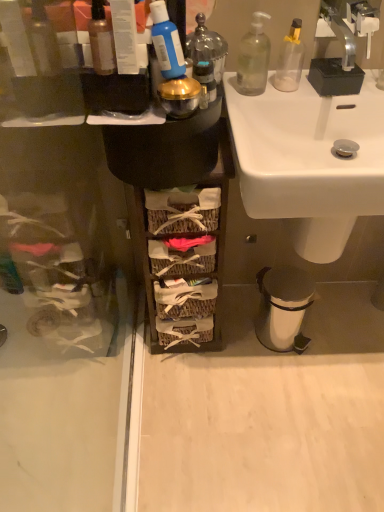
What do you see at coordinates (101, 40) in the screenshot?
I see `translucent glass bottle at upper left, placed as the first bottle when sorted from left to right` at bounding box center [101, 40].

Measure the distance between shiny metallic container at upper center, the 2th toiletry positioned from the front, and camera.

shiny metallic container at upper center, the 2th toiletry positioned from the front, and camera are 32.54 inches apart from each other.

Where is `silver metallic faucet at upper right`? silver metallic faucet at upper right is located at coordinates (350, 23).

Can you see transparent plastic bottle at upper right, the 1th bottle positioned from the right, touching clear glass bottle at upper right, the 2th bottle viewed from the back?

Yes.

Considering the relative sizes of transparent plastic bottle at upper right, the 1th bottle positioned from the right, and clear glass bottle at upper right, which is the 2th bottle from front to back, in the image provided, is transparent plastic bottle at upper right, the 1th bottle positioned from the right, bigger than clear glass bottle at upper right, which is the 2th bottle from front to back,?

Incorrect, transparent plastic bottle at upper right, the 1th bottle positioned from the right, is not larger than clear glass bottle at upper right, which is the 2th bottle from front to back.

From the image's perspective, is transparent plastic bottle at upper right, which is counted as the first bottle, starting from the back, located above clear glass bottle at upper right, acting as the 2th bottle starting from the left?

Correct, transparent plastic bottle at upper right, which is counted as the first bottle, starting from the back, appears higher than clear glass bottle at upper right, acting as the 2th bottle starting from the left, in the image.

Based on the photo, is transparent plastic bottle at upper right, the 1th bottle positioned from the right, oriented away from clear glass bottle at upper right, the 2th bottle viewed from the back?

No, clear glass bottle at upper right, the 2th bottle viewed from the back, is not at the back of transparent plastic bottle at upper right, the 1th bottle positioned from the right.

From the image's perspective, is translucent glass bottle at upper left, which ranks as the first bottle in front-to-back order, positioned above or below woven wood baskets at center?

Based on their image positions, translucent glass bottle at upper left, which ranks as the first bottle in front-to-back order, is located above woven wood baskets at center.

Which object is more forward, translucent glass bottle at upper left, marked as the 3th bottle in a back-to-front arrangement, or woven wood baskets at center?

Positioned in front is translucent glass bottle at upper left, marked as the 3th bottle in a back-to-front arrangement.

Visually, is translucent glass bottle at upper left, which ranks as the first bottle in front-to-back order, positioned to the left or to the right of woven wood baskets at center?

translucent glass bottle at upper left, which ranks as the first bottle in front-to-back order, is to the left of woven wood baskets at center.

Where is `cabinetry located on the right of translucent glass bottle at upper left, marked as the 3th bottle in a back-to-front arrangement`? Image resolution: width=384 pixels, height=512 pixels. cabinetry located on the right of translucent glass bottle at upper left, marked as the 3th bottle in a back-to-front arrangement is located at coordinates (190, 237).

Is white ceramic sink at center at the back of woven wood baskets at center?

No.

Who is more distant, woven wood baskets at center or white ceramic sink at center?

woven wood baskets at center is behind.

Is woven wood baskets at center touching white ceramic sink at center?

There is a gap between woven wood baskets at center and white ceramic sink at center.

How many degrees apart are the facing directions of woven wood baskets at center and white ceramic sink at center?

0.128 degrees separate the facing orientations of woven wood baskets at center and white ceramic sink at center.

Can you confirm if shiny metallic container at upper center, the 2th toiletry positioned from the front, is taller than clear glass bottle at upper right, which is the 2th bottle from front to back?

No.

Can we say shiny metallic container at upper center, arranged as the first toiletry when viewed from the back, lies outside clear glass bottle at upper right, the 2th bottle viewed from the back?

That's correct, shiny metallic container at upper center, arranged as the first toiletry when viewed from the back, is outside of clear glass bottle at upper right, the 2th bottle viewed from the back.

From the picture: Could you tell me if shiny metallic container at upper center, the 2th toiletry positioned from the front, is turned towards clear glass bottle at upper right, which is the 2th bottle from front to back?

No.

Locate an element on the screen. The width and height of the screenshot is (384, 512). toiletry that is the 1st object located below the clear glass bottle at upper right, which is the 2th bottle from front to back (from the image's perspective) is located at coordinates (207, 47).

In the scene shown: Between shiny metallic container at upper center, the 2th toiletry positioned from the front, and white ceramic sink at center, which one is positioned in front?

white ceramic sink at center is more forward.

From the image's perspective, is shiny metallic container at upper center, arranged as the first toiletry when viewed from the back, above or below white ceramic sink at center?

shiny metallic container at upper center, arranged as the first toiletry when viewed from the back, is above white ceramic sink at center.

Considering the positions of points (204, 37) and (255, 114), is point (204, 37) closer to camera compared to point (255, 114)?

Yes, point (204, 37) is in front of point (255, 114).

From a real-world perspective, who is located higher, shiny metallic container at upper center, arranged as the first toiletry when viewed from the back, or white ceramic sink at center?

shiny metallic container at upper center, arranged as the first toiletry when viewed from the back.

From a real-world perspective, between blue matte toothpaste tube at upper center, the 2th toiletry from the back, and transparent plastic bottle at upper right, the 3th bottle in the front-to-back sequence, who is vertically lower?

transparent plastic bottle at upper right, the 3th bottle in the front-to-back sequence, is physically lower.

Which object is positioned more to the left, blue matte toothpaste tube at upper center, acting as the first toiletry starting from the front, or transparent plastic bottle at upper right, the 3th bottle positioned from the left?

From the viewer's perspective, blue matte toothpaste tube at upper center, acting as the first toiletry starting from the front, appears more on the left side.

Do you think blue matte toothpaste tube at upper center, the 2th toiletry from the back, is within transparent plastic bottle at upper right, the 1th bottle positioned from the right, or outside of it?

blue matte toothpaste tube at upper center, the 2th toiletry from the back, cannot be found inside transparent plastic bottle at upper right, the 1th bottle positioned from the right.

Between clear glass bottle at upper right, acting as the 2th bottle starting from the left, and silver metallic faucet at upper right, which one has larger width?

Wider between the two is silver metallic faucet at upper right.

Based on the photo, which of these two, clear glass bottle at upper right, which is the 2th bottle from front to back, or silver metallic faucet at upper right, is bigger?

With larger size is silver metallic faucet at upper right.

Is clear glass bottle at upper right, which is the 2th bottle from front to back, situated inside silver metallic faucet at upper right or outside?

clear glass bottle at upper right, which is the 2th bottle from front to back, is spatially situated outside silver metallic faucet at upper right.

The height and width of the screenshot is (512, 384). Identify the location of bottle located above the clear glass bottle at upper right, placed as the second bottle when sorted from right to left (from the image's perspective). (290, 60).

The width and height of the screenshot is (384, 512). Identify the location of cabinetry located underneath the translucent glass bottle at upper left, marked as the third bottle in a right-to-left arrangement (from a real-world perspective). (190, 237).

Which object lies nearer to the anchor point blue matte toothpaste tube at upper center, the 2th toiletry from the back, woven wood baskets at center or shiny metallic container at upper center, arranged as the first toiletry when viewed from the back?

Among the two, shiny metallic container at upper center, arranged as the first toiletry when viewed from the back, is located nearer to blue matte toothpaste tube at upper center, the 2th toiletry from the back.

When comparing their distances from transparent plastic screen door at left, does blue matte toothpaste tube at upper center, the 2th toiletry from the back, or woven wood baskets at center seem closer?

Based on the image, woven wood baskets at center appears to be nearer to transparent plastic screen door at left.

Looking at the image, which one is located closer to transparent plastic screen door at left, white ceramic sink at center or woven wood baskets at center?

Based on the image, woven wood baskets at center appears to be nearer to transparent plastic screen door at left.

Considering their positions, is silver metallic faucet at upper right positioned further to transparent plastic screen door at left than transparent plastic bottle at upper right, which is counted as the first bottle, starting from the back?

Based on the image, silver metallic faucet at upper right appears to be further to transparent plastic screen door at left.

Estimate the real-world distances between objects in this image. Which object is further from transparent plastic bottle at upper right, the 1th bottle positioned from the right, shiny metallic container at upper center, the 2th toiletry positioned from the front, or transparent plastic screen door at left?

transparent plastic screen door at left is positioned further to the anchor transparent plastic bottle at upper right, the 1th bottle positioned from the right.

Which object lies nearer to the anchor point blue matte toothpaste tube at upper center, acting as the first toiletry starting from the front, shiny metallic container at upper center, the 2th toiletry positioned from the front, or woven wood baskets at center?

shiny metallic container at upper center, the 2th toiletry positioned from the front.

Based on their spatial positions, is clear glass bottle at upper right, placed as the second bottle when sorted from right to left, or shiny metallic container at upper center, the 2th toiletry positioned from the front, further from translucent glass bottle at upper left, marked as the 3th bottle in a back-to-front arrangement?

Among the two, clear glass bottle at upper right, placed as the second bottle when sorted from right to left, is located further to translucent glass bottle at upper left, marked as the 3th bottle in a back-to-front arrangement.

When comparing their distances from shiny metallic container at upper center, the 2th toiletry positioned from the front, does blue matte toothpaste tube at upper center, the 2th toiletry from the back, or silver metallic trash can at lower right seem closer?

blue matte toothpaste tube at upper center, the 2th toiletry from the back, is positioned closer to the anchor shiny metallic container at upper center, the 2th toiletry positioned from the front.

Locate an element on the screen. sink between translucent glass bottle at upper left, placed as the first bottle when sorted from left to right, and silver metallic trash can at lower right from front to back is located at coordinates (309, 160).

The height and width of the screenshot is (512, 384). I want to click on toiletry located between translucent glass bottle at upper left, marked as the 3th bottle in a back-to-front arrangement, and shiny metallic container at upper center, the 2th toiletry positioned from the front, in the left-right direction, so click(165, 42).

I want to click on sink between clear glass bottle at upper right, placed as the second bottle when sorted from right to left, and woven wood baskets at center vertically, so click(309, 160).

Locate an element on the screen. This screenshot has height=512, width=384. sink between transparent plastic screen door at left and transparent plastic bottle at upper right, which is counted as the first bottle, starting from the back, in the front-back direction is located at coordinates (309, 160).